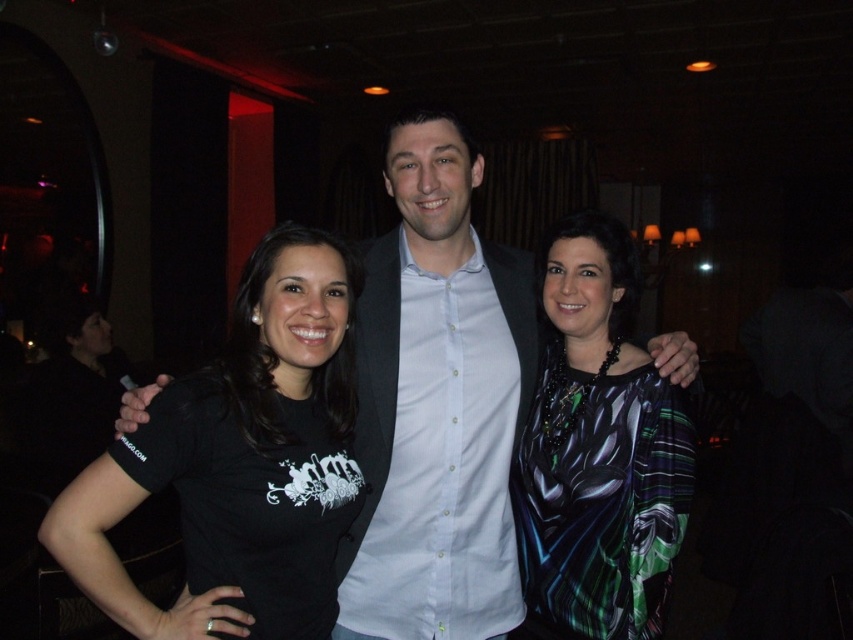
Who is positioned more to the right, shiny silk blouse at center or black matte t-shirt at left?

Positioned to the right is shiny silk blouse at center.

Who is taller, shiny silk blouse at center or black matte t-shirt at left?

With more height is shiny silk blouse at center.

Is point (605, 324) more distant than point (251, 515)?

That is True.

Where is `shiny silk blouse at center`? shiny silk blouse at center is located at coordinates pos(599,449).

Between point (474, 614) and point (641, 474), which one is positioned behind?

Positioned behind is point (474, 614).

The width and height of the screenshot is (853, 640). Find the location of `white shirt at center`. white shirt at center is located at coordinates (437, 403).

Can you confirm if white shirt at center is shorter than black matte t-shirt at left?

No.

Is point (456, 547) behind point (200, 412)?

Yes, it is behind point (200, 412).

Locate an element on the screen. white shirt at center is located at coordinates (437, 403).

At what (x,y) coordinates should I click in order to perform the action: click on white shirt at center. Please return your answer as a coordinate pair (x, y). Looking at the image, I should click on (437, 403).